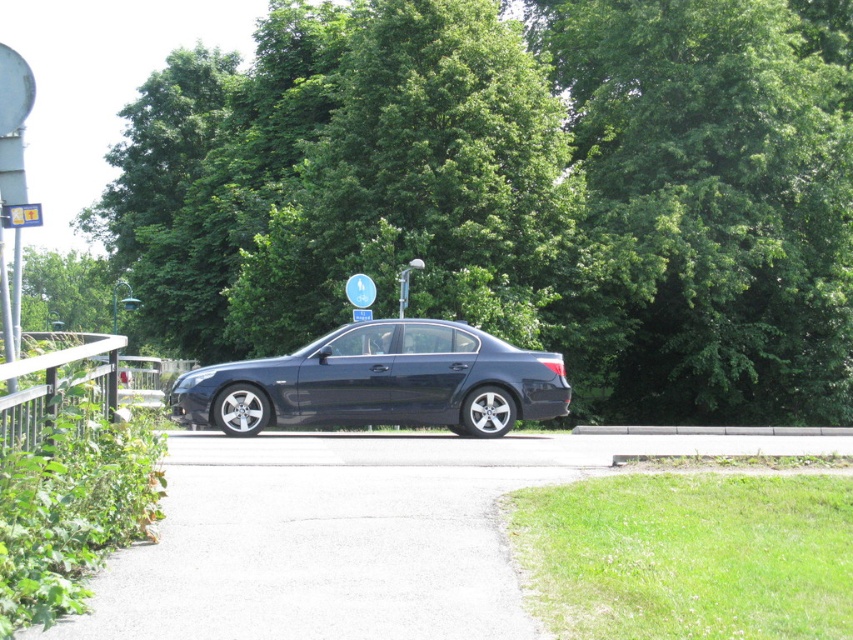
Question: Which object appears closest to the camera in this image?

Choices:
 (A) green leafy tree at center
 (B) glossy black sedan at center

Answer: (B)

Question: Can you confirm if green leafy tree at center is positioned to the left of glossy black sedan at center?

Choices:
 (A) no
 (B) yes

Answer: (B)

Question: Which point is closer to the camera taking this photo?

Choices:
 (A) (305, 337)
 (B) (352, 292)
 (C) (55, 376)
 (D) (125, 291)

Answer: (C)

Question: Can you confirm if glossy black sedan at center is thinner than green leafy tree at upper center?

Choices:
 (A) yes
 (B) no

Answer: (A)

Question: Observing the image, what is the correct spatial positioning of green leafy tree at center in reference to green leafy tree at upper center?

Choices:
 (A) below
 (B) above

Answer: (B)

Question: Which point is farther to the camera?

Choices:
 (A) blue plastic sign at center
 (B) glossy black sedan at center

Answer: (A)